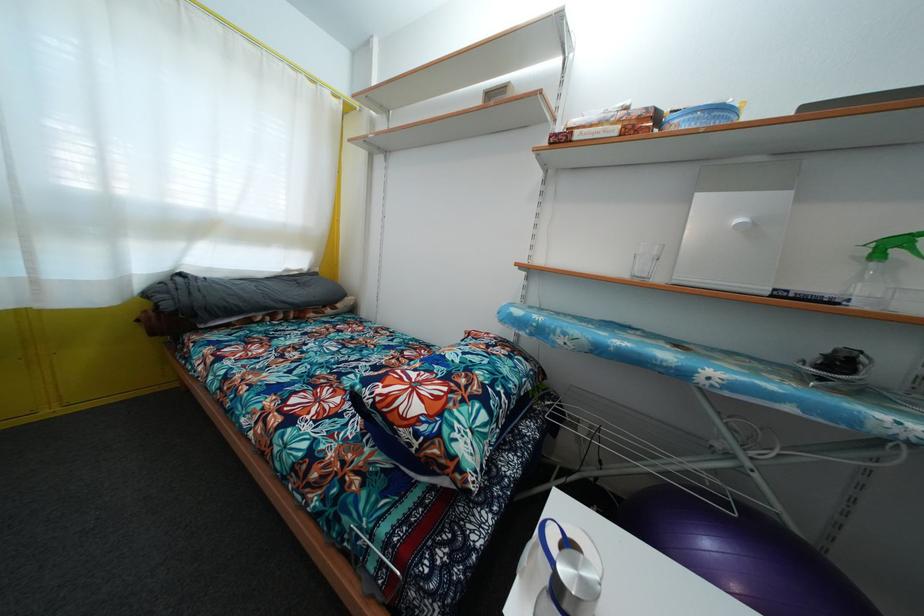
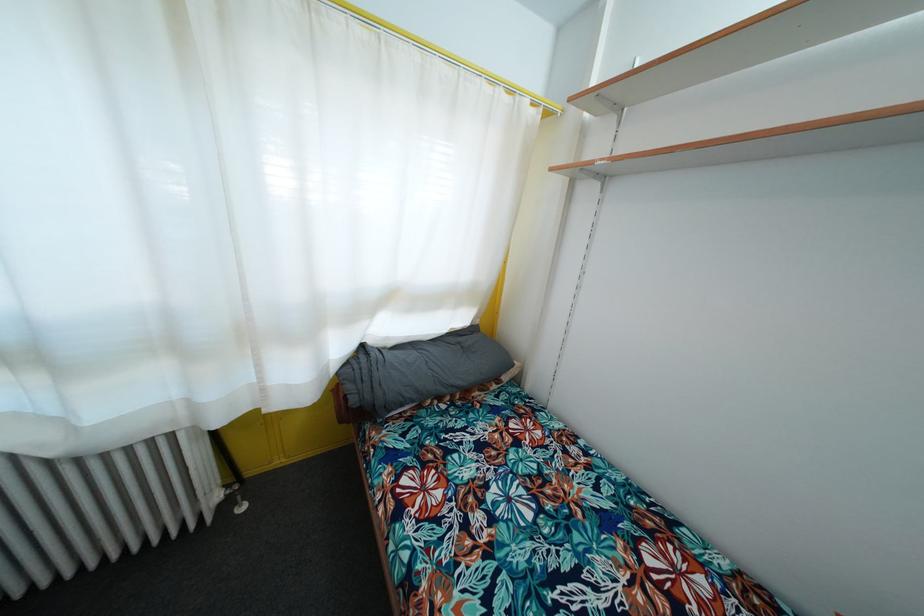
Question: The first image is from the beginning of the video and the second image is from the end. How did the camera likely rotate when shooting the video?

Choices:
 (A) Left
 (B) Right
 (C) Up
 (D) Down

Answer: (A)